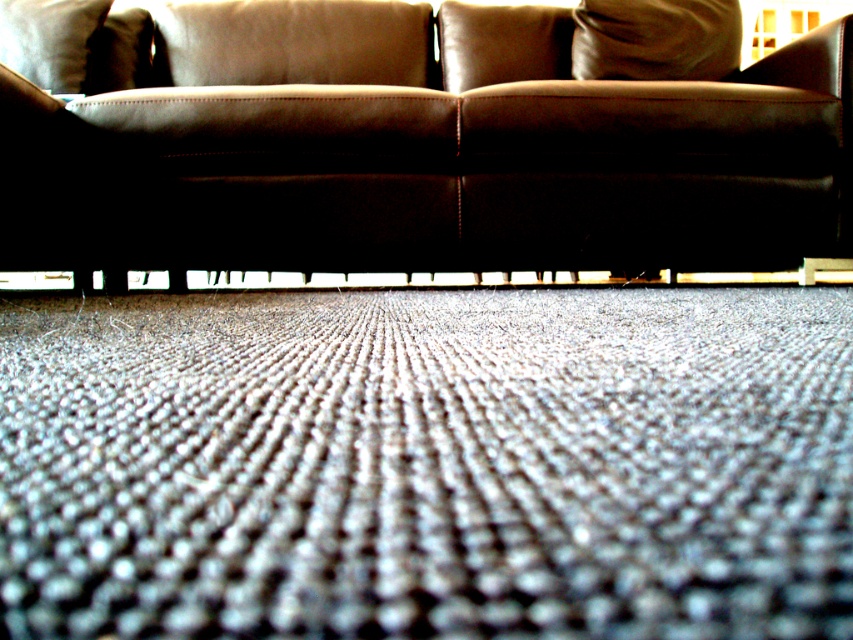
Looking at this image, you need to place a small potted plant on either the gray textured mat at lower center or the leather couch at center. Which surface can accommodate the plant without overcrowding?

The gray textured mat at lower center has a smaller size compared to the leather couch at center, so the plant would fit better on the leather couch at center to avoid overcrowding.

You are standing in a living room and want to place a small potted plant between the gray textured mat at lower center and the leather couch at center. Based on their positions, where should you place the plant?

The gray textured mat at lower center is located below the leather couch at center, so you should place the plant between them by positioning it just above the gray textured mat at lower center and below the leather couch at center.

You are standing in the room and want to place a small decorative item between the two points, point (x=706, y=460) and point (x=669, y=157). Which point should the item be closer to if you want it to be nearer to the foreground of the image?

The item should be closer to point (x=706, y=460) because it is in front of point (x=669, y=157), so placing it near that point will keep it closer to the foreground.